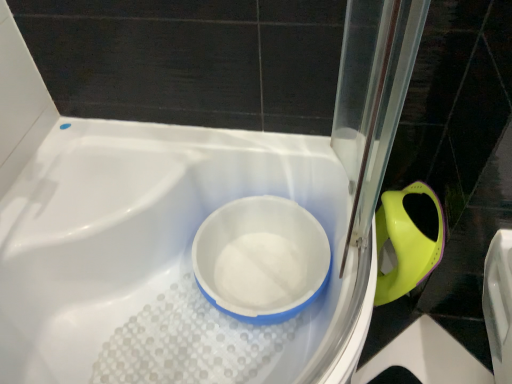
Question: From the image's perspective, relative to matte green plastic bidet at right, is white plastic bath at center above or below?

Choices:
 (A) below
 (B) above

Answer: (A)

Question: From a real-world perspective, is white plastic bath at center above or below matte green plastic bidet at right?

Choices:
 (A) below
 (B) above

Answer: (B)

Question: Which object is the closest to the white plastic bowl at center?

Choices:
 (A) matte green plastic bidet at right
 (B) white plastic bath at center

Answer: (B)

Question: Which object is the closest to the white plastic bowl at center?

Choices:
 (A) matte green plastic bidet at right
 (B) white plastic bath at center

Answer: (B)